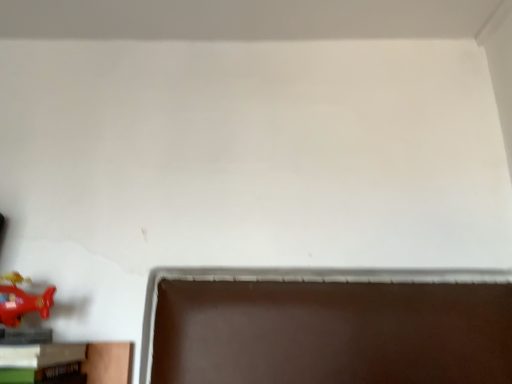
The image size is (512, 384). What do you see at coordinates (22, 300) in the screenshot?
I see `shiny red airplane at lower left` at bounding box center [22, 300].

You are a GUI agent. You are given a task and a screenshot of the screen. Output one action in this format:
    pyautogui.click(x=<x>, y=<y>)
    Task: Click on the shiny red airplane at lower left
    This screenshot has height=384, width=512.
    Given the screenshot: What is the action you would take?
    pyautogui.click(x=22, y=300)

Image resolution: width=512 pixels, height=384 pixels. What do you see at coordinates (72, 362) in the screenshot?
I see `wooden bookshelf at lower left` at bounding box center [72, 362].

You are a GUI agent. You are given a task and a screenshot of the screen. Output one action in this format:
    pyautogui.click(x=<x>, y=<y>)
    Task: Click on the wooden bookshelf at lower left
    This screenshot has width=512, height=384.
    Given the screenshot: What is the action you would take?
    pyautogui.click(x=72, y=362)

This screenshot has width=512, height=384. I want to click on shiny red airplane at lower left, so click(22, 300).

From the picture: Which object is positioned more to the right, shiny red airplane at lower left or wooden bookshelf at lower left?

From the viewer's perspective, wooden bookshelf at lower left appears more on the right side.

Looking at this image, is the position of shiny red airplane at lower left more distant than that of wooden bookshelf at lower left?

Yes, it is.

Does point (20, 309) come in front of point (76, 357)?

Yes, point (20, 309) is in front of point (76, 357).

From the image's perspective, is shiny red airplane at lower left located above or below wooden bookshelf at lower left?

Clearly, from the image's perspective, shiny red airplane at lower left is above wooden bookshelf at lower left.

In the scene shown: From a real-world perspective, who is located higher, shiny red airplane at lower left or wooden bookshelf at lower left?

In real-world perspective, shiny red airplane at lower left is above.

Consider the image. Considering the sizes of objects shiny red airplane at lower left and wooden bookshelf at lower left in the image provided, who is thinner, shiny red airplane at lower left or wooden bookshelf at lower left?

shiny red airplane at lower left is thinner.

Based on the photo, which of these two, shiny red airplane at lower left or wooden bookshelf at lower left, stands taller?

Standing taller between the two is wooden bookshelf at lower left.

Considering the relative sizes of shiny red airplane at lower left and wooden bookshelf at lower left in the image provided, is shiny red airplane at lower left bigger than wooden bookshelf at lower left?

No.

Is shiny red airplane at lower left located outside wooden bookshelf at lower left?

Absolutely, shiny red airplane at lower left is external to wooden bookshelf at lower left.

Would you say shiny red airplane at lower left is a long distance from wooden bookshelf at lower left?

No, there isn't a large distance between shiny red airplane at lower left and wooden bookshelf at lower left.

Is shiny red airplane at lower left oriented towards wooden bookshelf at lower left?

No, shiny red airplane at lower left is not turned towards wooden bookshelf at lower left.

How many degrees apart are the facing directions of shiny red airplane at lower left and wooden bookshelf at lower left?

5.99 degrees.

This screenshot has width=512, height=384. In order to click on toy on the left of the wooden bookshelf at lower left in this screenshot , I will do `click(22, 300)`.

Does wooden bookshelf at lower left appear on the left side of shiny red airplane at lower left?

In fact, wooden bookshelf at lower left is to the right of shiny red airplane at lower left.

Which object is closer to the camera taking this photo, wooden bookshelf at lower left or shiny red airplane at lower left?

Positioned in front is wooden bookshelf at lower left.

Considering the points (93, 343) and (1, 312), which point is in front, point (93, 343) or point (1, 312)?

Point (1, 312)

From the image's perspective, between wooden bookshelf at lower left and shiny red airplane at lower left, who is located below?

wooden bookshelf at lower left, from the image's perspective.

From a real-world perspective, is wooden bookshelf at lower left on shiny red airplane at lower left?

No, from a real-world perspective, wooden bookshelf at lower left is not above shiny red airplane at lower left.

Considering the sizes of wooden bookshelf at lower left and shiny red airplane at lower left in the image, is wooden bookshelf at lower left wider or thinner than shiny red airplane at lower left?

wooden bookshelf at lower left is wider than shiny red airplane at lower left.

In the scene shown: Can you confirm if wooden bookshelf at lower left is shorter than shiny red airplane at lower left?

Incorrect, the height of wooden bookshelf at lower left does not fall short of that of shiny red airplane at lower left.

Considering the sizes of wooden bookshelf at lower left and shiny red airplane at lower left in the image, is wooden bookshelf at lower left bigger or smaller than shiny red airplane at lower left?

In the image, wooden bookshelf at lower left appears to be larger than shiny red airplane at lower left.

Is shiny red airplane at lower left a part of wooden bookshelf at lower left?

No, shiny red airplane at lower left is not surrounded by wooden bookshelf at lower left.

Is wooden bookshelf at lower left next to shiny red airplane at lower left?

There is a gap between wooden bookshelf at lower left and shiny red airplane at lower left.

Is wooden bookshelf at lower left positioned with its back to shiny red airplane at lower left?

No, wooden bookshelf at lower left is not facing away from shiny red airplane at lower left.

How different are the orientations of wooden bookshelf at lower left and shiny red airplane at lower left in degrees?

The angle between the facing direction of wooden bookshelf at lower left and the facing direction of shiny red airplane at lower left is 5.99 degrees.

The width and height of the screenshot is (512, 384). Identify the location of toy behind the wooden bookshelf at lower left. (22, 300).

You are a GUI agent. You are given a task and a screenshot of the screen. Output one action in this format:
    pyautogui.click(x=<x>, y=<y>)
    Task: Click on the toy that is above the wooden bookshelf at lower left (from a real-world perspective)
    
    Given the screenshot: What is the action you would take?
    pyautogui.click(x=22, y=300)

Where is `toy that is on the left side of wooden bookshelf at lower left`? toy that is on the left side of wooden bookshelf at lower left is located at coordinates (22, 300).